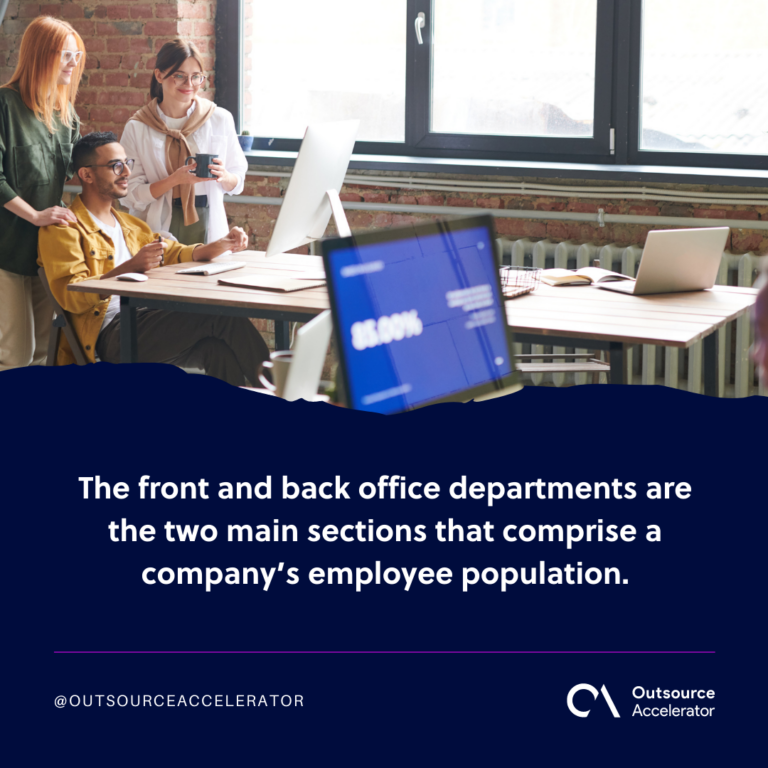
The width and height of the screenshot is (768, 768). Find the location of `laptop`. laptop is located at coordinates (414, 306).